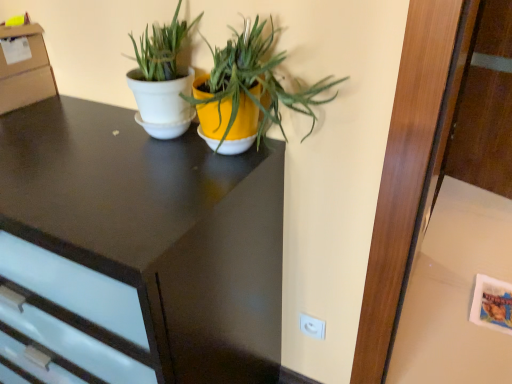
The width and height of the screenshot is (512, 384). I want to click on vacant point to the left of white glossy pot at center, the first houseplant from the right, so 139,163.